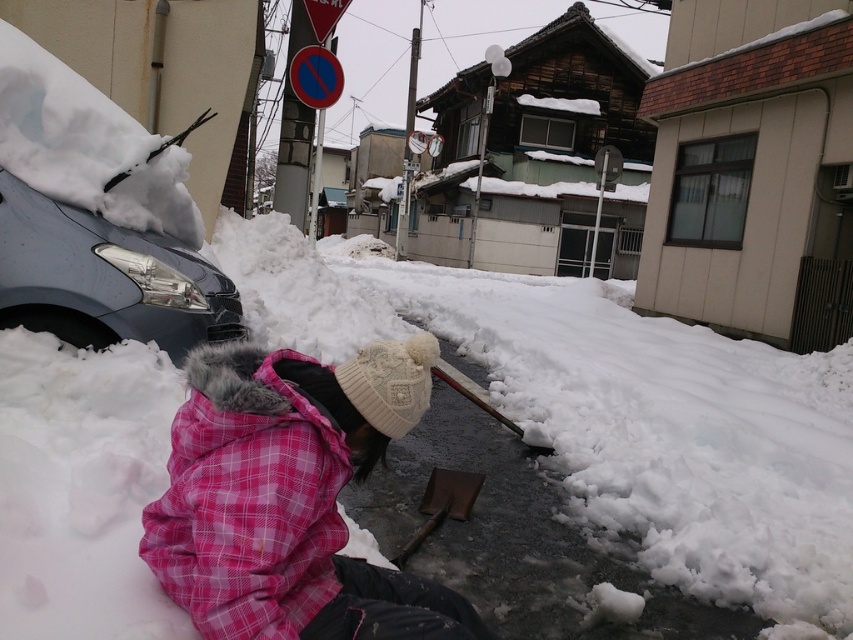
You are standing at the point with coordinates point (32, 202) and want to walk to the point with coordinates point (244, 449). Which direction should you move to get closer to your destination?

You should move forward because point (244, 449) is closer to the viewer than point (32, 202).

You are a delivery person trying to reach the front door of the modern building with light colored siding and large windows. You see the pink fleece jacket at lower left and the wooden shovel at center. Which object is closer to you as you approach the building?

The pink fleece jacket at lower left is closer to you than the wooden shovel at center, so you would see it first as you approach the building.

You are standing at the point labeled point (117, 598) in the snowy urban street scene. You want to take a photo of the entire scene with your camera, which has a maximum range of 2 meters. Will you be able to capture the entire scene in one shot?

The point labeled point (117, 598) is 1.81 meters away from the camera, which is within the camera maximum range of 2 meters. Therefore, you can capture the entire scene in one shot.